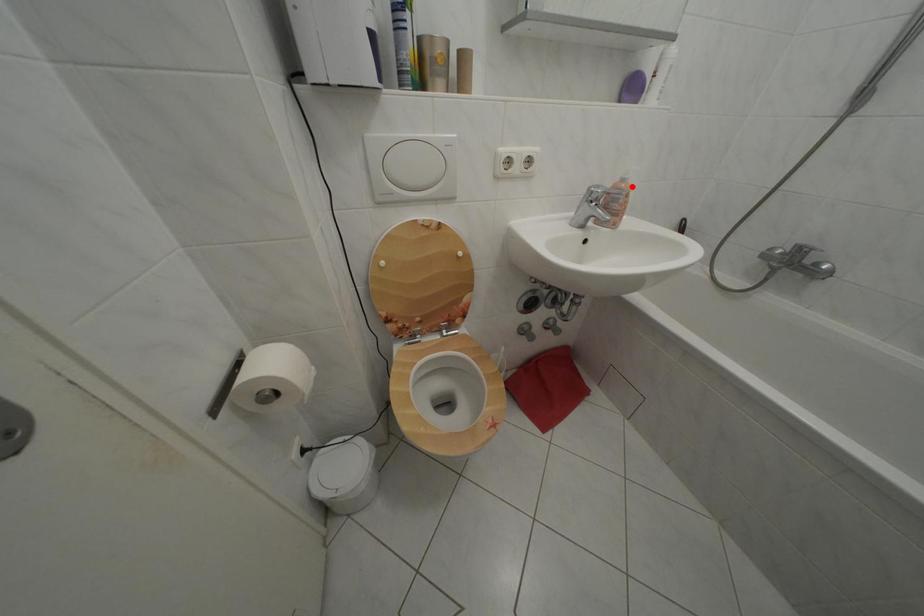
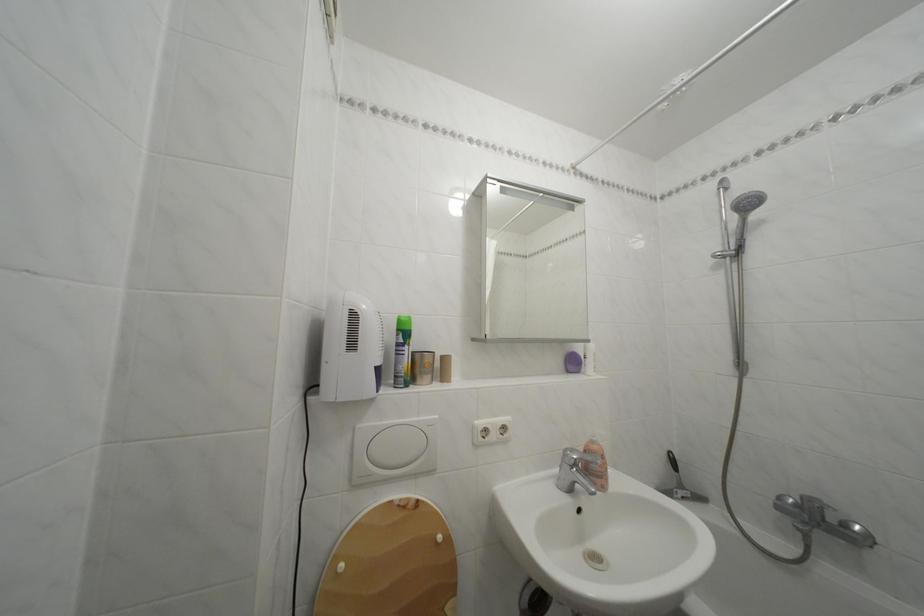
The point at the highlighted location is marked in the first image. Where is the corresponding point in the second image?

(602, 448)